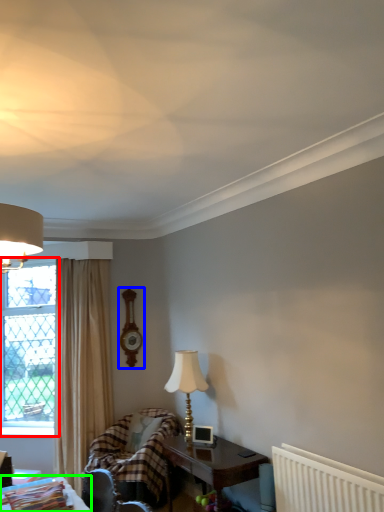
Question: Based on their relative distances, which object is farther from window (highlighted by a red box)? Choose from clock (highlighted by a blue box) and table (highlighted by a green box).

Choices:
 (A) clock
 (B) table

Answer: (B)